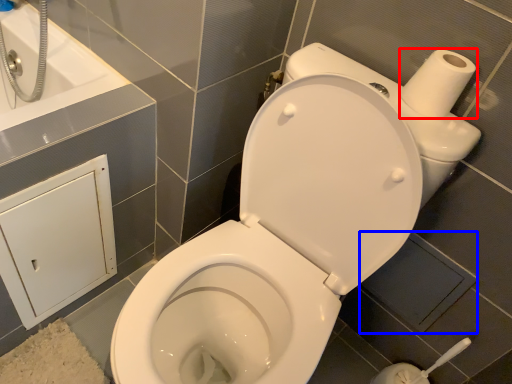
Question: Which of the following is the farthest to the observer, toilet paper (highlighted by a red box) or square (highlighted by a blue box)?

Choices:
 (A) toilet paper
 (B) square

Answer: (B)